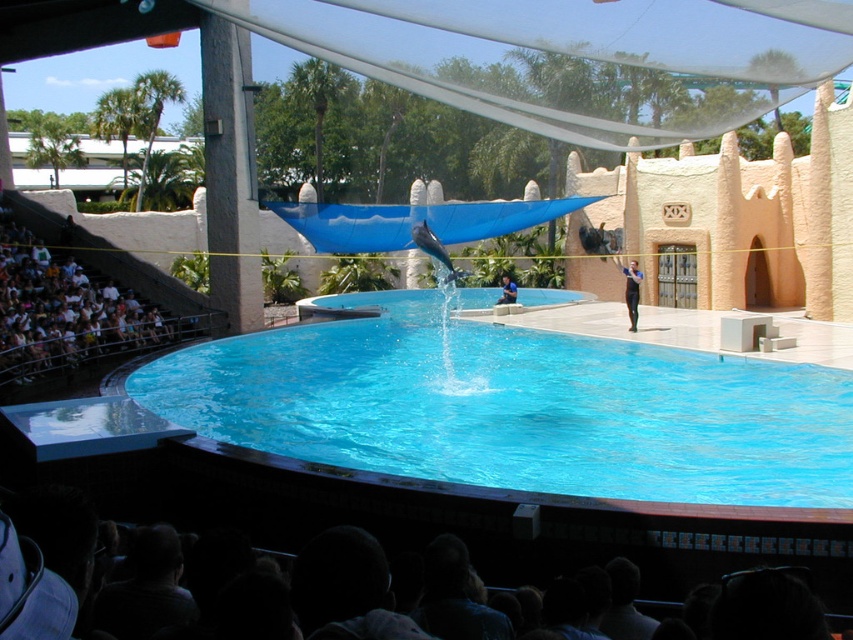
You are a visitor at the dolphin show and want to sit in a seat that is closest to the pool. The white fabric seat at left is located at point (64, 310). Is this seat closer to the pool than the other seats?

The white fabric seat at left is located at point (64, 310), which is the closest seat to the pool. Therefore, this seat is the best option for someone wanting to be near the pool.

You are a guest at the dolphin show and want to sit comfortably. The white fabric seat at left and the black wetsuit at center are both in your line of sight. Which object is larger and would provide more seating space?

The white fabric seat at left is bigger than the black wetsuit at center, so it would provide more seating space.

In the scene shown: You are standing at the dolphin show and want to take a photo of the dolphin. The camera you have can focus up to 70 meters. Is the point at coordinates point (80, 289) within the camera focus range?

The distance of point (80, 289) from the camera is 69.37 meters, which is within the camera focus range of up to 70 meters. Yes, the point is within range.